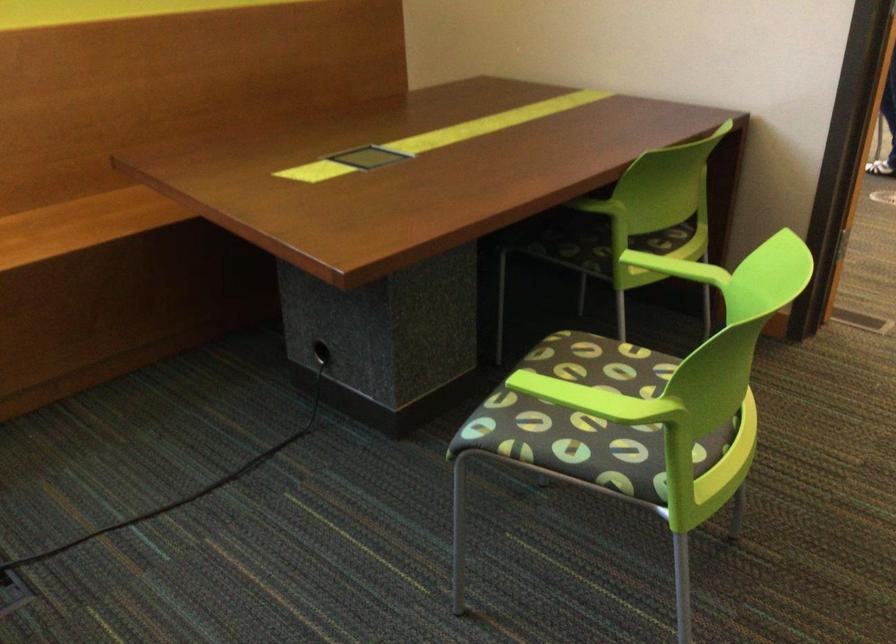
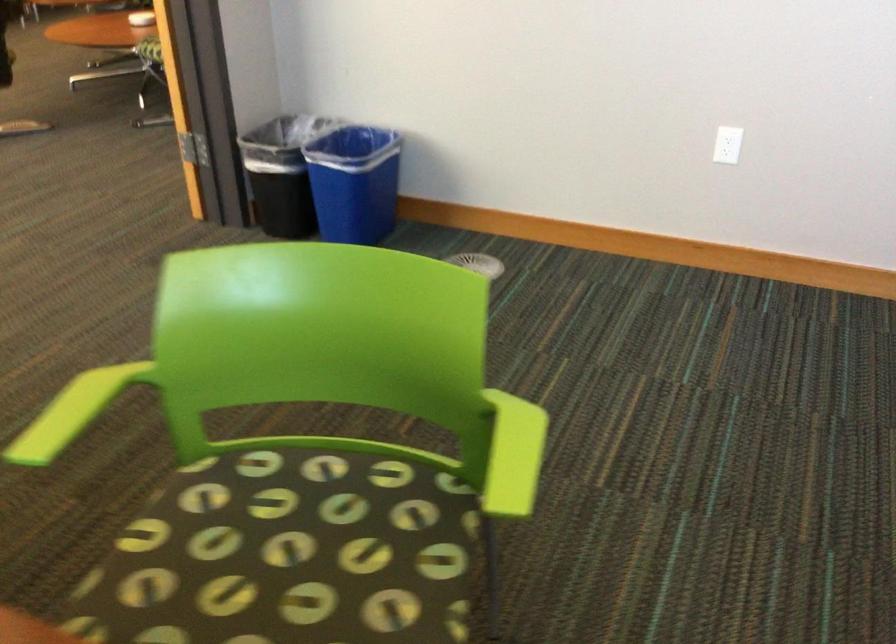
Find the pixel in the second image that matches point 636,257 in the first image.

(55, 429)